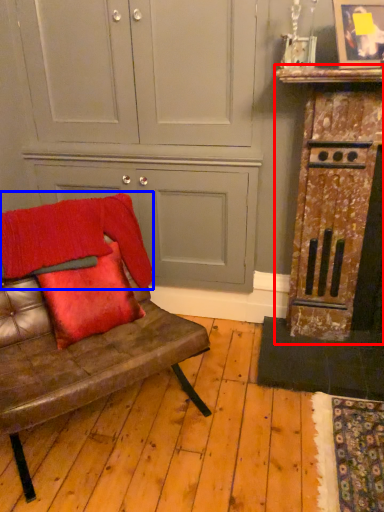
Question: Which point is further to the camera, dresser (highlighted by a red box) or blanket (highlighted by a blue box)?

Choices:
 (A) dresser
 (B) blanket

Answer: (A)